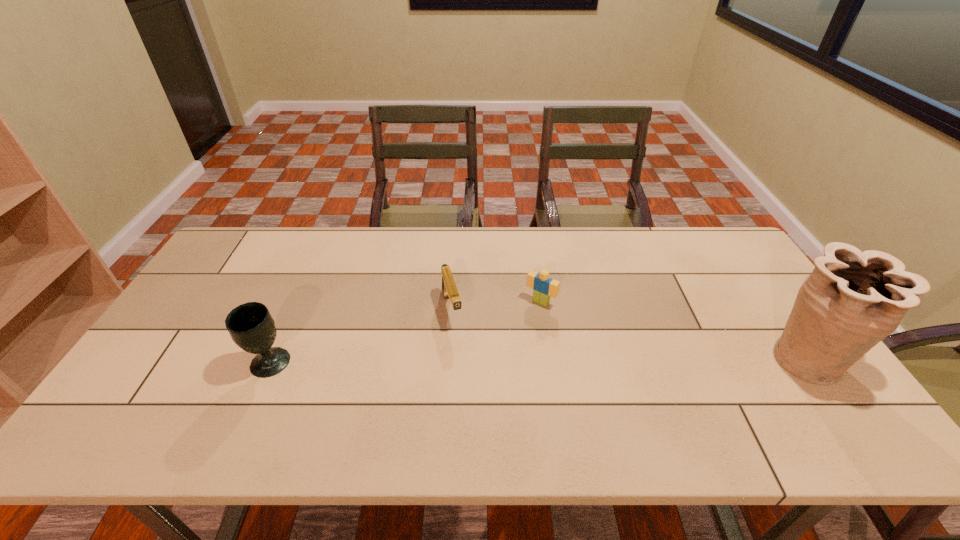
Find the location of `vacant space located at the barrel of the second object from left to right`. vacant space located at the barrel of the second object from left to right is located at coordinates (462, 359).

Image resolution: width=960 pixels, height=540 pixels. What are the coordinates of `free spot located on the face of the Lego` in the screenshot? It's located at (516, 330).

You are a GUI agent. You are given a task and a screenshot of the screen. Output one action in this format:
    pyautogui.click(x=<x>, y=<y>)
    Task: Click on the free space located 0.310m on the face of the Lego
    
    Given the screenshot: What is the action you would take?
    pyautogui.click(x=474, y=382)

What are the coordinates of `vacant space located 0.080m on the face of the Lego` in the screenshot? It's located at (519, 326).

The image size is (960, 540). I want to click on object present at the near edge, so tap(852, 300).

I want to click on object at the right edge, so click(852, 300).

Identify the location of object that is at the near right corner. (852, 300).

The width and height of the screenshot is (960, 540). Find the location of `vacant region at the far edge of the desktop`. vacant region at the far edge of the desktop is located at coordinates (398, 244).

The height and width of the screenshot is (540, 960). In the image, there is a desktop. What are the coordinates of `blank space at the near edge` in the screenshot? It's located at (502, 396).

Identify the location of vacant area at the left edge of the desktop. (134, 380).